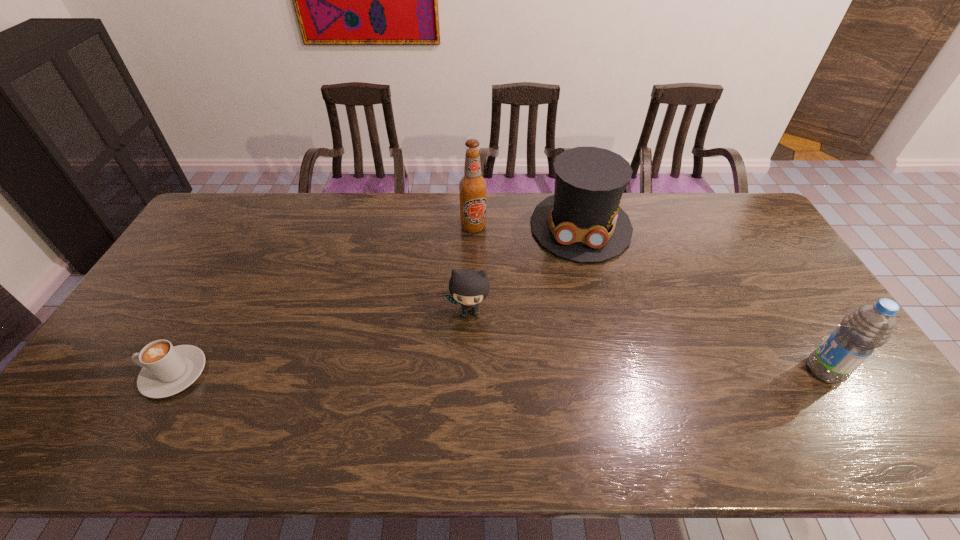
Find the location of a particular element. free space on the desktop that is between the cappuccino and the rightmost object and is positioned on the front label of the tallest object is located at coordinates (492, 372).

The image size is (960, 540). What are the coordinates of `vacant space on the desktop that is between the leftmost object and the water bottle and is positioned with goggles on the front of the dress hat` in the screenshot? It's located at (576, 372).

Identify the location of vacant spot on the desktop that is between the shortest object and the rightmost object and is positioned on the front-facing side of the third nearest object. (463, 372).